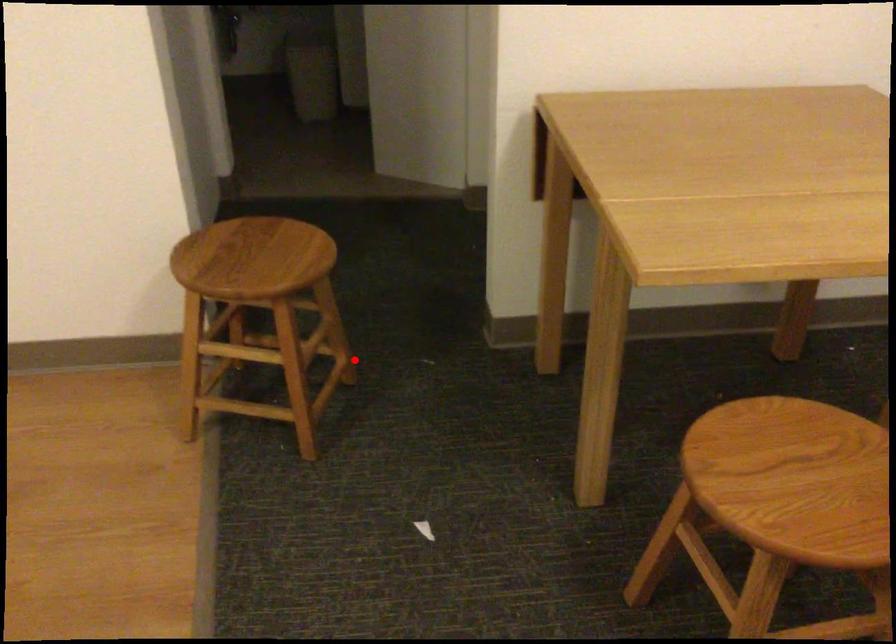
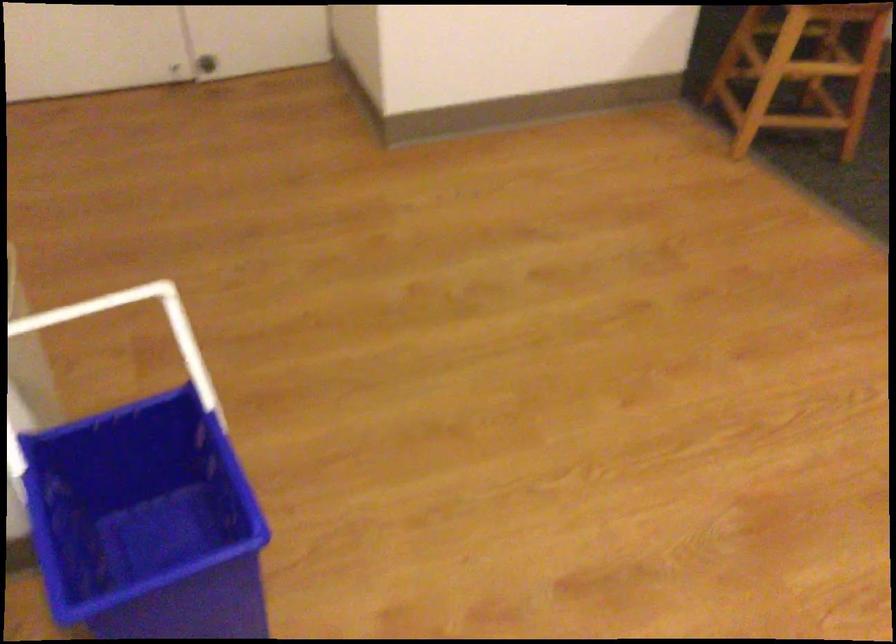
In the second image, find the point that corresponds to the highlighted location in the first image.

(794, 90)